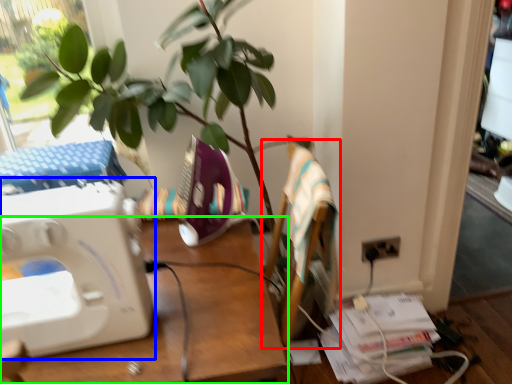
Question: Which object is positioned closest to armchair (highlighted by a red box)? Select from sewing machine (highlighted by a blue box) and desk (highlighted by a green box).

Choices:
 (A) sewing machine
 (B) desk

Answer: (B)